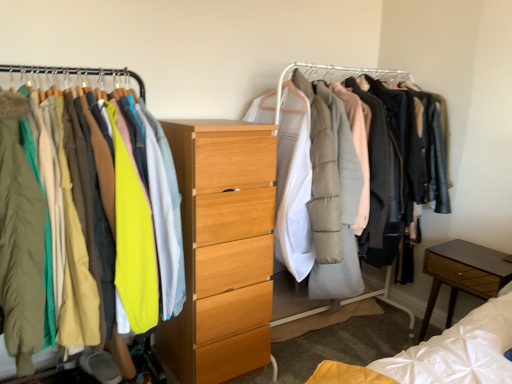
Question: Can you confirm if matte yellow jacket at left, placed as the second clothing when sorted from front to back, is taller than matte yellow jacket at left, placed as the 1th clothing when sorted from back to front?

Choices:
 (A) no
 (B) yes

Answer: (B)

Question: From the image's perspective, is matte yellow jacket at left, placed as the second clothing when sorted from front to back, above matte yellow jacket at left, the 3th clothing in the front-to-back sequence?

Choices:
 (A) yes
 (B) no

Answer: (B)

Question: From the image's perspective, would you say matte yellow jacket at left, placed as the second clothing when sorted from front to back, is shown under matte yellow jacket at left, the 3th clothing in the front-to-back sequence?

Choices:
 (A) no
 (B) yes

Answer: (B)

Question: Considering the relative sizes of matte yellow jacket at left, the 2th clothing when ordered from back to front, and matte yellow jacket at left, placed as the 1th clothing when sorted from back to front, in the image provided, is matte yellow jacket at left, the 2th clothing when ordered from back to front, bigger than matte yellow jacket at left, placed as the 1th clothing when sorted from back to front,?

Choices:
 (A) yes
 (B) no

Answer: (A)

Question: Is matte yellow jacket at left, placed as the second clothing when sorted from front to back, to the right of matte yellow jacket at left, placed as the 1th clothing when sorted from back to front, from the viewer's perspective?

Choices:
 (A) no
 (B) yes

Answer: (A)

Question: Considering the relative sizes of matte yellow jacket at left, the 2th clothing when ordered from back to front, and matte yellow jacket at left, placed as the 1th clothing when sorted from back to front, in the image provided, is matte yellow jacket at left, the 2th clothing when ordered from back to front, wider than matte yellow jacket at left, placed as the 1th clothing when sorted from back to front,?

Choices:
 (A) yes
 (B) no

Answer: (B)

Question: Can you confirm if matte yellow jacket at left, placed as the second clothing when sorted from front to back, is wider than brown wood nightstand at lower right?

Choices:
 (A) yes
 (B) no

Answer: (A)

Question: From a real-world perspective, is matte yellow jacket at left, placed as the second clothing when sorted from front to back, positioned over brown wood nightstand at lower right based on gravity?

Choices:
 (A) yes
 (B) no

Answer: (A)

Question: From a real-world perspective, does matte yellow jacket at left, placed as the second clothing when sorted from front to back, sit lower than brown wood nightstand at lower right?

Choices:
 (A) yes
 (B) no

Answer: (B)

Question: From the image's perspective, is matte yellow jacket at left, placed as the second clothing when sorted from front to back, below brown wood nightstand at lower right?

Choices:
 (A) no
 (B) yes

Answer: (A)

Question: From the image's perspective, does matte yellow jacket at left, placed as the second clothing when sorted from front to back, appear higher than brown wood nightstand at lower right?

Choices:
 (A) no
 (B) yes

Answer: (B)

Question: Is matte yellow jacket at left, the 2th clothing when ordered from back to front, to the right of brown wood nightstand at lower right from the viewer's perspective?

Choices:
 (A) no
 (B) yes

Answer: (A)

Question: Does matte white coat rack at center come in front of matte green coat at left, the 3th clothing when ordered from back to front?

Choices:
 (A) no
 (B) yes

Answer: (A)